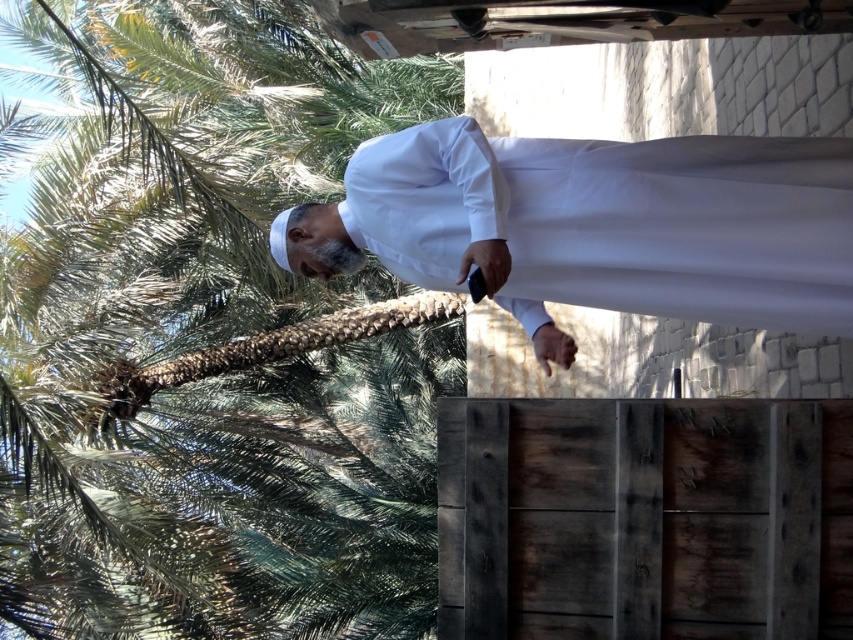
You are a drone operator trying to capture a photo of the man in white attire. The drone is currently positioned at point A, which is at coordinates 0.5, 0.25. The green leafy palm tree at upper left is at point 0.528, 0.242. To avoid the palm tree, which direction should you move the drone slightly? Please answer with either left, right, up, or down.

The green leafy palm tree at upper left is located at point (206, 337). Since the drone is at (212, 320), which is slightly to the left and slightly below the palm tree, moving the drone slightly to the right would help avoid the tree.